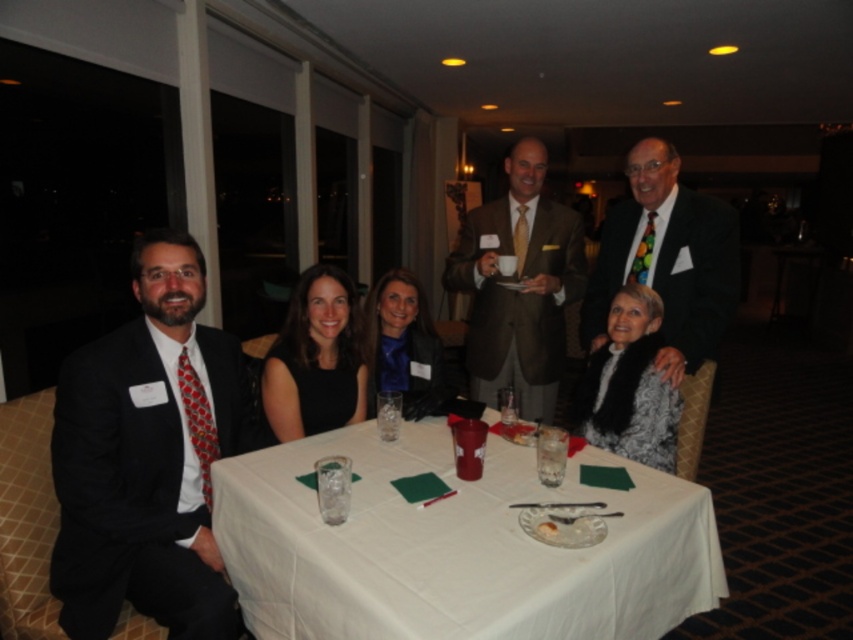
Question: Can you confirm if matte brown suit at center is smaller than multicolored tie at upper right?

Choices:
 (A) yes
 (B) no

Answer: (B)

Question: Among these points, which one is nearest to the camera?

Choices:
 (A) (659, 221)
 (B) (151, 353)
 (C) (502, 230)
 (D) (573, 401)

Answer: (B)

Question: Which point is closer to the camera?

Choices:
 (A) (647, 404)
 (B) (375, 337)
 (C) (280, 509)

Answer: (C)

Question: Among these objects, which one is nearest to the camera?

Choices:
 (A) matte black suit at left
 (B) shiny blue blouse at center
 (C) white cloth at center

Answer: (C)

Question: Is white cloth at center closer to the viewer compared to white textured sweater at center?

Choices:
 (A) yes
 (B) no

Answer: (A)

Question: Can you confirm if matte black suit at left is positioned above black fabric dress at center?

Choices:
 (A) no
 (B) yes

Answer: (A)